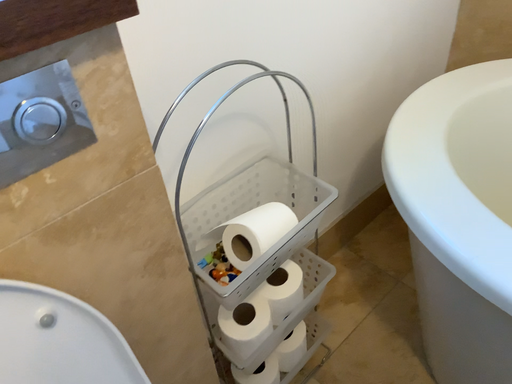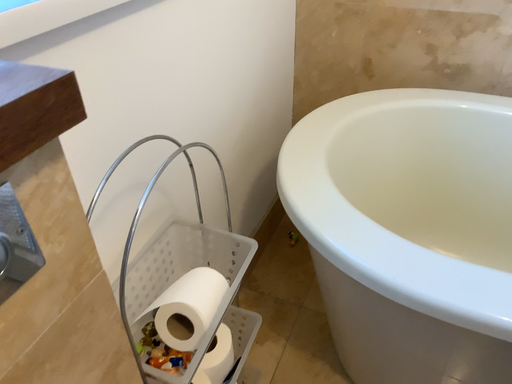
Question: How did the camera likely rotate when shooting the video?

Choices:
 (A) rotated downward
 (B) rotated upward

Answer: (B)